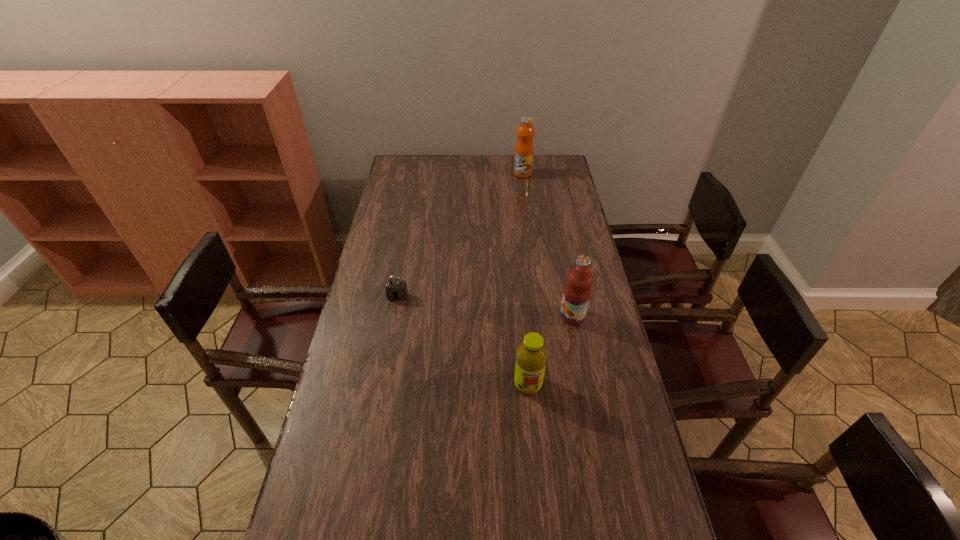
This screenshot has height=540, width=960. I want to click on vacant space that is in between the nearest fruit juice and the farthest fruit juice, so click(525, 279).

You are a GUI agent. You are given a task and a screenshot of the screen. Output one action in this format:
    pyautogui.click(x=<x>, y=<y>)
    Task: Click on the vacant area that lies between the shortest fruit juice and the farthest object
    The height and width of the screenshot is (540, 960).
    Given the screenshot: What is the action you would take?
    pyautogui.click(x=525, y=279)

Image resolution: width=960 pixels, height=540 pixels. In order to click on free space between the nearest fruit juice and the farthest fruit juice in this screenshot , I will do `click(525, 279)`.

At what (x,y) coordinates should I click in order to perform the action: click on vacant area between the shortest fruit juice and the second nearest object. Please return your answer as a coordinate pair (x, y). This screenshot has width=960, height=540. Looking at the image, I should click on (550, 350).

This screenshot has width=960, height=540. I want to click on vacant region between the farthest object and the second shortest object, so click(525, 279).

Locate an element on the screen. This screenshot has width=960, height=540. free space that is in between the farthest object and the nearest fruit juice is located at coordinates (525, 279).

The height and width of the screenshot is (540, 960). Find the location of `vacant space that is in between the rightmost object and the padlock`. vacant space that is in between the rightmost object and the padlock is located at coordinates (485, 306).

I want to click on vacant space that is in between the farthest fruit juice and the shortest object, so click(460, 235).

Where is `free space between the shortest object and the farthest object`? This screenshot has height=540, width=960. free space between the shortest object and the farthest object is located at coordinates (460, 235).

At what (x,y) coordinates should I click in order to perform the action: click on empty space between the nearest fruit juice and the farthest object. Please return your answer as a coordinate pair (x, y). This screenshot has width=960, height=540. Looking at the image, I should click on pyautogui.click(x=525, y=279).